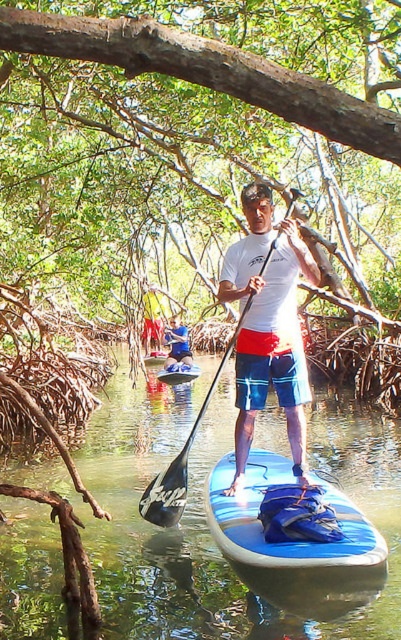
Question: Can you confirm if white matte shirt at center is positioned below black rubber paddle at center?

Choices:
 (A) yes
 (B) no

Answer: (A)

Question: Considering the real-world distances, which object is closest to the blue fabric shorts at center?

Choices:
 (A) white matte shirt at center
 (B) blue rubber paddleboard at center
 (C) blue glossy canoe at center
 (D) black rubber paddle at center

Answer: (C)

Question: Which object is the farthest from the black rubber paddle at center?

Choices:
 (A) blue rubber paddleboard at center
 (B) blue glossy canoe at center

Answer: (B)

Question: Is white matte shirt at center thinner than blue fabric shorts at center?

Choices:
 (A) yes
 (B) no

Answer: (A)

Question: Which of the following is the closest to the observer?

Choices:
 (A) (198, 376)
 (B) (362, 456)
 (C) (249, 340)

Answer: (C)

Question: Is black rubber paddle at center closer to camera compared to blue glossy canoe at center?

Choices:
 (A) no
 (B) yes

Answer: (B)